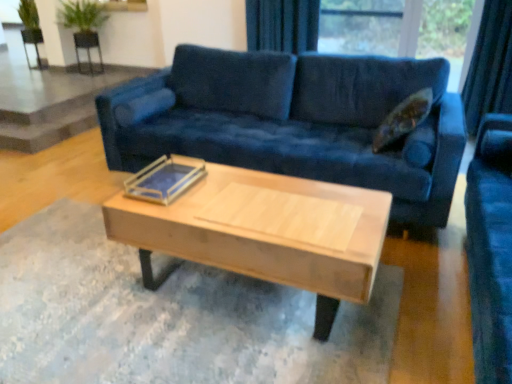
Question: Is black mesh chair at upper left, positioned as the first armchair in right-to-left order, completely or partially inside light wood/wooden coffee table at center?

Choices:
 (A) yes
 (B) no

Answer: (B)

Question: Does light wood/wooden coffee table at center have a lesser width compared to black mesh chair at upper left, positioned as the first armchair in right-to-left order?

Choices:
 (A) yes
 (B) no

Answer: (B)

Question: Can you confirm if light wood/wooden coffee table at center is smaller than black mesh chair at upper left, positioned as the first armchair in right-to-left order?

Choices:
 (A) no
 (B) yes

Answer: (A)

Question: Is light wood/wooden coffee table at center shorter than black mesh chair at upper left, positioned as the first armchair in right-to-left order?

Choices:
 (A) yes
 (B) no

Answer: (A)

Question: From a real-world perspective, is light wood/wooden coffee table at center positioned over black mesh chair at upper left, positioned as the first armchair in right-to-left order, based on gravity?

Choices:
 (A) no
 (B) yes

Answer: (A)

Question: Looking at their shapes, would you say velvet dark blue curtain at upper center is wider or thinner than metallic silver armchair at upper left, the second armchair in the right-to-left sequence?

Choices:
 (A) thin
 (B) wide

Answer: (A)

Question: Does point (312, 26) appear closer or farther from the camera than point (23, 31)?

Choices:
 (A) closer
 (B) farther

Answer: (A)

Question: Would you say velvet dark blue curtain at upper center is to the left or to the right of metallic silver armchair at upper left, marked as the first armchair in a left-to-right arrangement, in the picture?

Choices:
 (A) right
 (B) left

Answer: (A)

Question: Is velvet dark blue curtain at upper center in front of or behind metallic silver armchair at upper left, the second armchair in the right-to-left sequence, in the image?

Choices:
 (A) front
 (B) behind

Answer: (A)

Question: Is black mesh chair at upper left, the second armchair when ordered from left to right, taller or shorter than clear acrylic tray at center?

Choices:
 (A) short
 (B) tall

Answer: (B)

Question: Relative to clear acrylic tray at center, is black mesh chair at upper left, the second armchair when ordered from left to right, in front or behind?

Choices:
 (A) behind
 (B) front

Answer: (A)

Question: From the image's perspective, relative to clear acrylic tray at center, is black mesh chair at upper left, the second armchair when ordered from left to right, above or below?

Choices:
 (A) below
 (B) above

Answer: (B)

Question: Considering the positions of black mesh chair at upper left, positioned as the first armchair in right-to-left order, and clear acrylic tray at center in the image, is black mesh chair at upper left, positioned as the first armchair in right-to-left order, bigger or smaller than clear acrylic tray at center?

Choices:
 (A) small
 (B) big

Answer: (B)

Question: Is point [94, 34] closer or farther from the camera than point [36, 41]?

Choices:
 (A) closer
 (B) farther

Answer: (B)

Question: Choose the correct answer: Is black mesh chair at upper left, positioned as the first armchair in right-to-left order, inside metallic silver armchair at upper left, the second armchair in the right-to-left sequence, or outside it?

Choices:
 (A) outside
 (B) inside

Answer: (A)